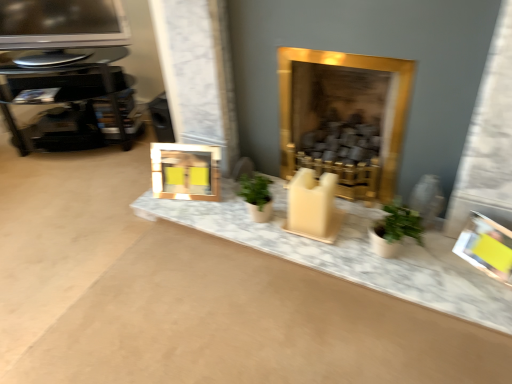
Question: Does yellow paper picture frame at right, arranged as the 2th picture frame when viewed from the top, contain marble counter top at center?

Choices:
 (A) no
 (B) yes

Answer: (A)

Question: From the image's perspective, would you say yellow paper picture frame at right, which is the second picture frame in left-to-right order, is positioned over marble counter top at center?

Choices:
 (A) no
 (B) yes

Answer: (A)

Question: Is yellow paper picture frame at right, positioned as the first picture frame in bottom-to-top order, turned away from marble counter top at center?

Choices:
 (A) no
 (B) yes

Answer: (A)

Question: Does yellow paper picture frame at right, positioned as the first picture frame in bottom-to-top order, turn towards marble counter top at center?

Choices:
 (A) yes
 (B) no

Answer: (B)

Question: Is yellow paper picture frame at right, which is the first picture frame in right-to-left order, at the left side of marble counter top at center?

Choices:
 (A) no
 (B) yes

Answer: (A)

Question: Can you confirm if yellow paper picture frame at right, which is the second picture frame in left-to-right order, is smaller than marble counter top at center?

Choices:
 (A) no
 (B) yes

Answer: (B)

Question: Would you say marble counter top at center is a long distance from metallic glossy television at upper left?

Choices:
 (A) no
 (B) yes

Answer: (B)

Question: Does marble counter top at center have a greater width compared to metallic glossy television at upper left?

Choices:
 (A) yes
 (B) no

Answer: (A)

Question: From a real-world perspective, is marble counter top at center under metallic glossy television at upper left?

Choices:
 (A) no
 (B) yes

Answer: (B)

Question: Is marble counter top at center thinner than metallic glossy television at upper left?

Choices:
 (A) no
 (B) yes

Answer: (A)

Question: Does marble counter top at center come in front of metallic glossy television at upper left?

Choices:
 (A) yes
 (B) no

Answer: (A)

Question: Is marble counter top at center surrounding metallic glossy television at upper left?

Choices:
 (A) no
 (B) yes

Answer: (A)

Question: From the image's perspective, is gold metallic fireplace at center beneath yellow paper picture frame at right, the second picture frame when ordered from back to front?

Choices:
 (A) no
 (B) yes

Answer: (A)